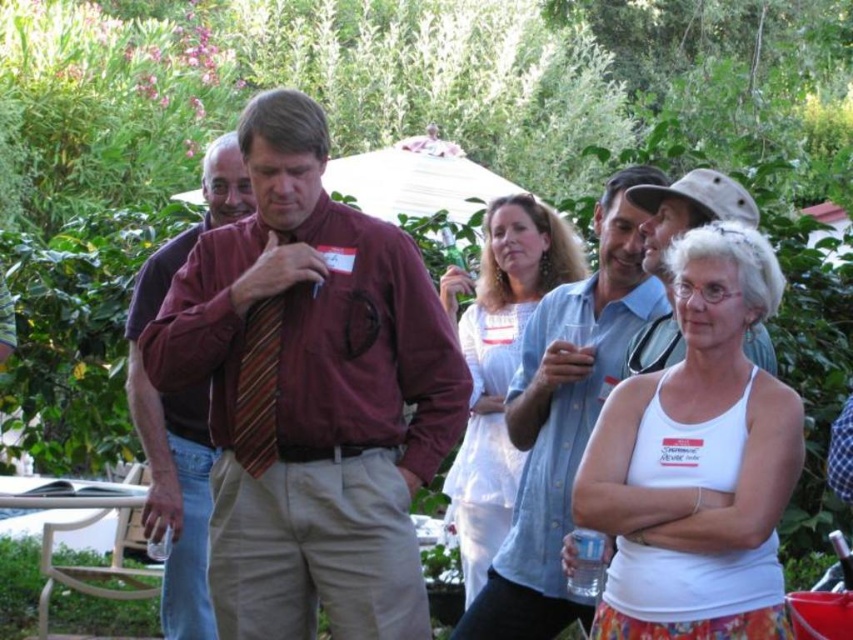
Question: Which object is the closest to the striped fabric tie at center?

Choices:
 (A) striped tie at center
 (B) white tank top at center

Answer: (A)

Question: Estimate the real-world distances between objects in this image. Which object is closer to the white tank top at center?

Choices:
 (A) light blue denim shirt at center
 (B) maroon fabric shirt at center
 (C) striped fabric tie at center

Answer: (B)

Question: Does light blue denim shirt at center appear on the right side of striped fabric tie at center?

Choices:
 (A) no
 (B) yes

Answer: (B)

Question: Is light blue denim shirt at center below striped tie at center?

Choices:
 (A) no
 (B) yes

Answer: (B)

Question: Is maroon fabric shirt at center wider than striped fabric tie at center?

Choices:
 (A) no
 (B) yes

Answer: (B)

Question: Which object is the closest to the striped tie at center?

Choices:
 (A) maroon fabric shirt at center
 (B) white tank top at center
 (C) light blue denim shirt at center

Answer: (A)